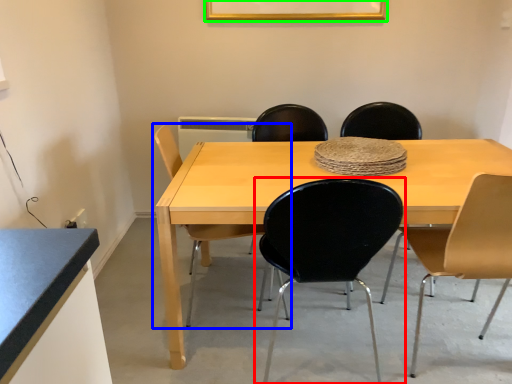
Question: Estimate the real-world distances between objects in this image. Which object is closer to chair (highlighted by a red box), chair (highlighted by a blue box) or picture frame (highlighted by a green box)?

Choices:
 (A) chair
 (B) picture frame

Answer: (A)